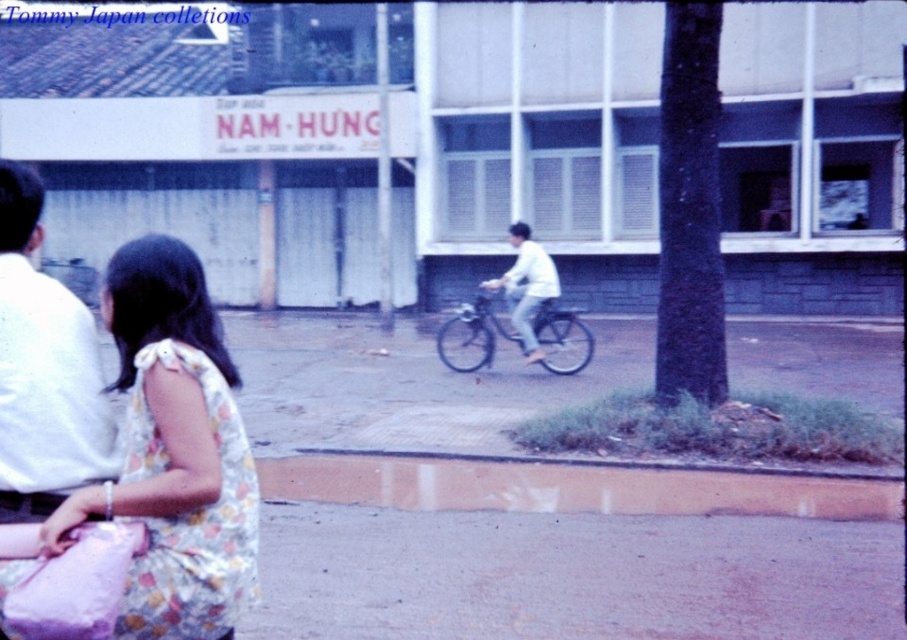
You are standing at the center of the image and want to locate the floral fabric dress at lower left. Based on the coordinates provided, in which direction should you look to find it?

The floral fabric dress at lower left is located at coordinates point (174, 451), so you should look to the lower left direction to find it.

You are taking a photo of the scene and want to focus on both point [122,378] and point [557,314]. Which point should you adjust your focus to first to ensure both are in sharp view?

Point [122,378] is closer to the camera than point [557,314]. To ensure both are in focus, adjust your focus to the closer point first, then recompose if necessary.